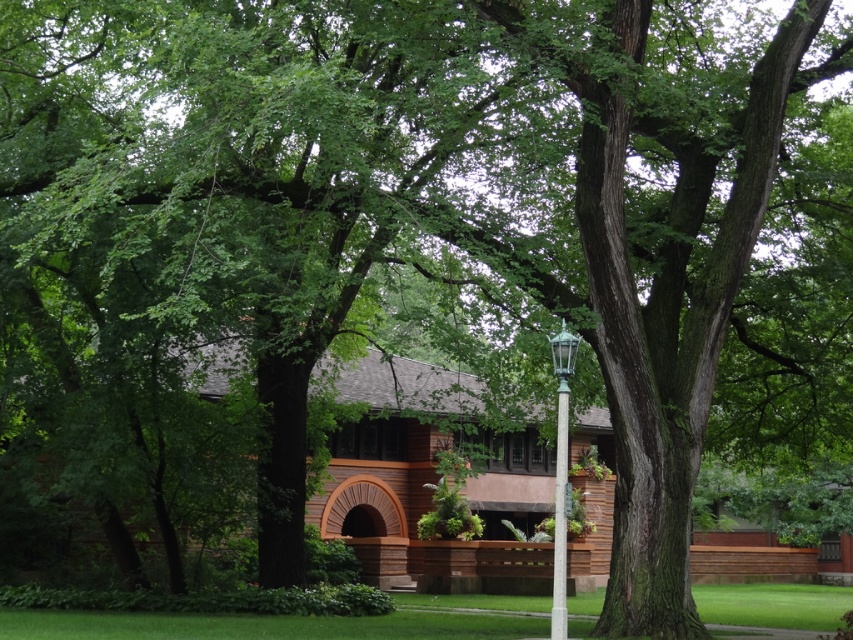
Question: Which of the following is the closest to the observer?

Choices:
 (A) green glass lamp post at center
 (B) green glass pole at center

Answer: (A)

Question: Is green grass at lower center to the right of green glass pole at center from the viewer's perspective?

Choices:
 (A) yes
 (B) no

Answer: (A)

Question: Which point is farther from the camera taking this photo?

Choices:
 (A) (561, 608)
 (B) (445, 630)

Answer: (B)

Question: Based on their relative distances, which object is farther from the green glass lamp post at center?

Choices:
 (A) green glass pole at center
 (B) green grass at lower center

Answer: (B)

Question: Is green grass at lower center closer to the viewer compared to green glass pole at center?

Choices:
 (A) yes
 (B) no

Answer: (B)

Question: Is green grass at lower center positioned before green glass pole at center?

Choices:
 (A) yes
 (B) no

Answer: (B)